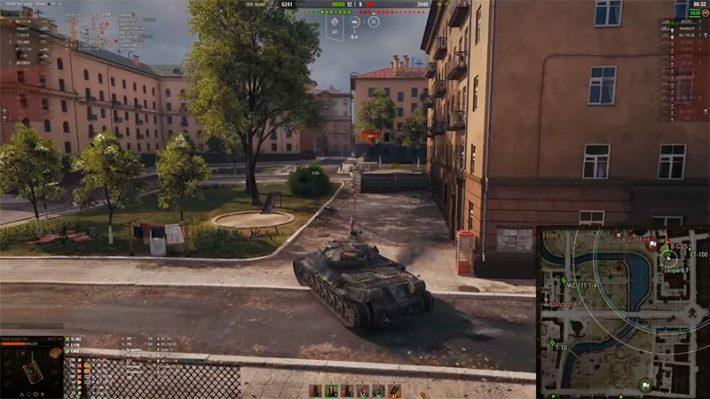
You are a GUI agent. You are given a task and a screenshot of the screen. Output one action in this format:
    pyautogui.click(x=<x>, y=<y>)
    Task: Click on the laundry
    
    Given the screenshot: What is the action you would take?
    pyautogui.click(x=153, y=228), pyautogui.click(x=160, y=245), pyautogui.click(x=172, y=237)